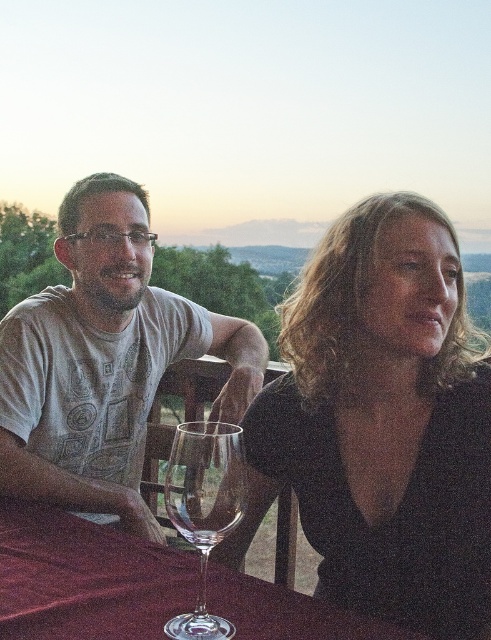
Is black matte dress at center thinner than matte gray t-shirt at left?

Yes.

Does point (471, 609) lie in front of point (93, 296)?

Yes, it is.

Does point (366, 580) lie behind point (54, 246)?

No, it is not.

I want to click on black matte dress at center, so click(381, 422).

Which is behind, point (343, 522) or point (42, 604)?

Positioned behind is point (343, 522).

Is point (473, 486) farther from camera compared to point (325, 627)?

Yes, it is behind point (325, 627).

The image size is (491, 640). What do you see at coordinates (381, 422) in the screenshot? I see `black matte dress at center` at bounding box center [381, 422].

In order to click on black matte dress at center in this screenshot , I will do `click(381, 422)`.

Is point (71, 502) closer to viewer compared to point (108, 586)?

That is False.

Image resolution: width=491 pixels, height=640 pixels. What do you see at coordinates (105, 360) in the screenshot? I see `matte gray t-shirt at left` at bounding box center [105, 360].

Find the location of a particular element. Image resolution: width=491 pixels, height=640 pixels. matte gray t-shirt at left is located at coordinates (105, 360).